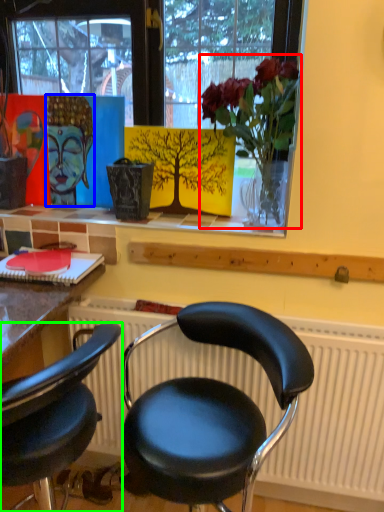
Question: Which object is positioned farthest from floral arrangement (highlighted by a red box)? Select from art (highlighted by a blue box) and chair (highlighted by a green box).

Choices:
 (A) art
 (B) chair

Answer: (B)